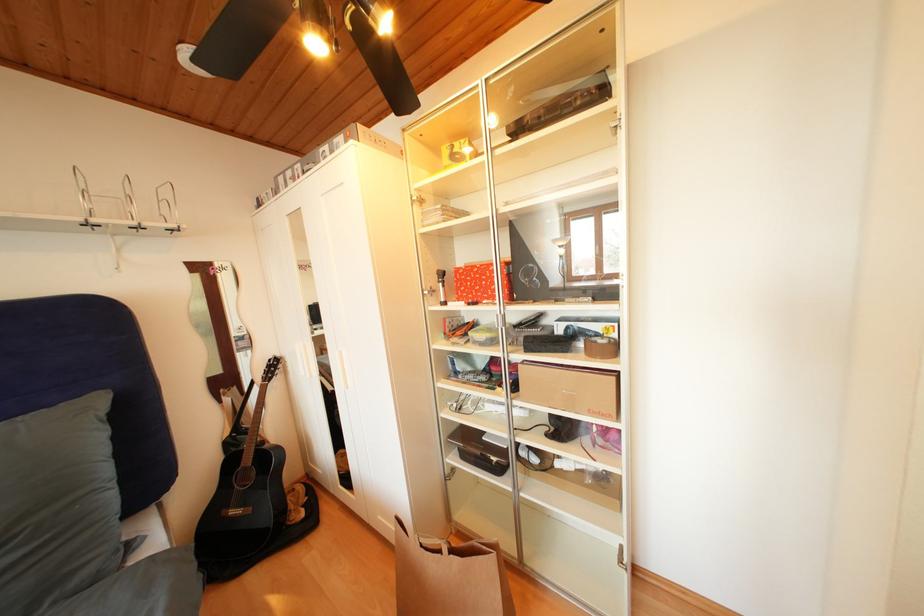
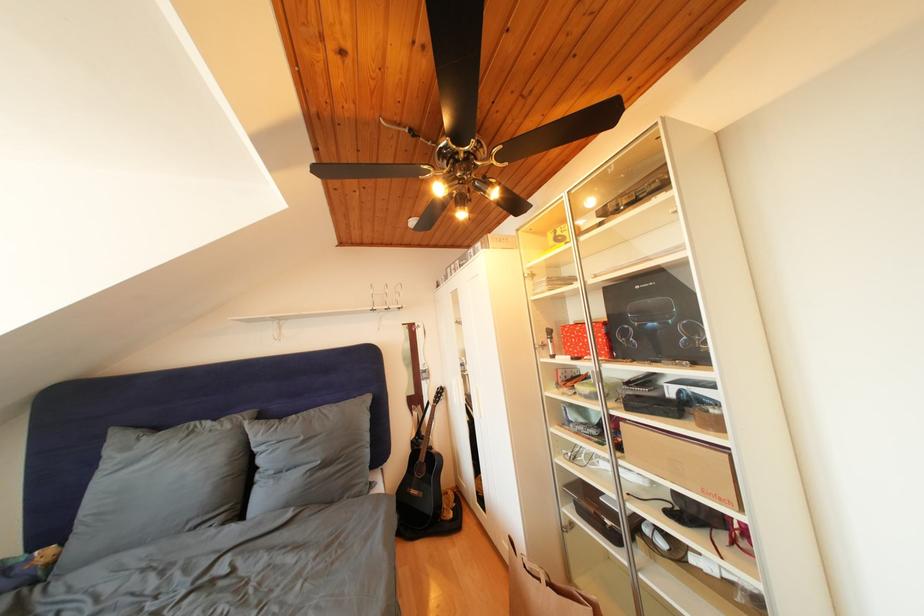
In the second image, find the point that corresponds to point 520,400 in the first image.

(626, 459)